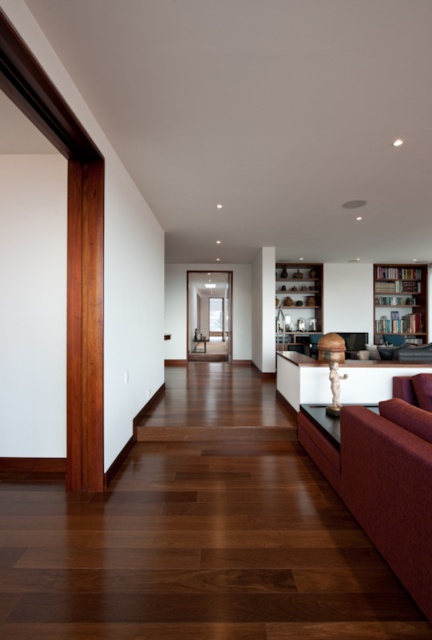
Question: Which point appears farthest from the camera in this image?

Choices:
 (A) (419, 288)
 (B) (421, 531)

Answer: (A)

Question: Which object is positioned farthest from the wooden bookshelf at right?

Choices:
 (A) wooden shelves at center
 (B) burgundy fabric couch at lower right

Answer: (B)

Question: Which of these objects is positioned farthest from the wooden bookshelf at right?

Choices:
 (A) burgundy fabric couch at lower right
 (B) wooden shelves at center

Answer: (A)

Question: From the image, what is the correct spatial relationship of wooden shelves at center in relation to wooden bookshelf at right?

Choices:
 (A) right
 (B) left

Answer: (B)

Question: Can you confirm if wooden shelves at center is positioned below wooden bookshelf at right?

Choices:
 (A) yes
 (B) no

Answer: (A)

Question: Is wooden shelves at center below wooden bookshelf at right?

Choices:
 (A) no
 (B) yes

Answer: (B)